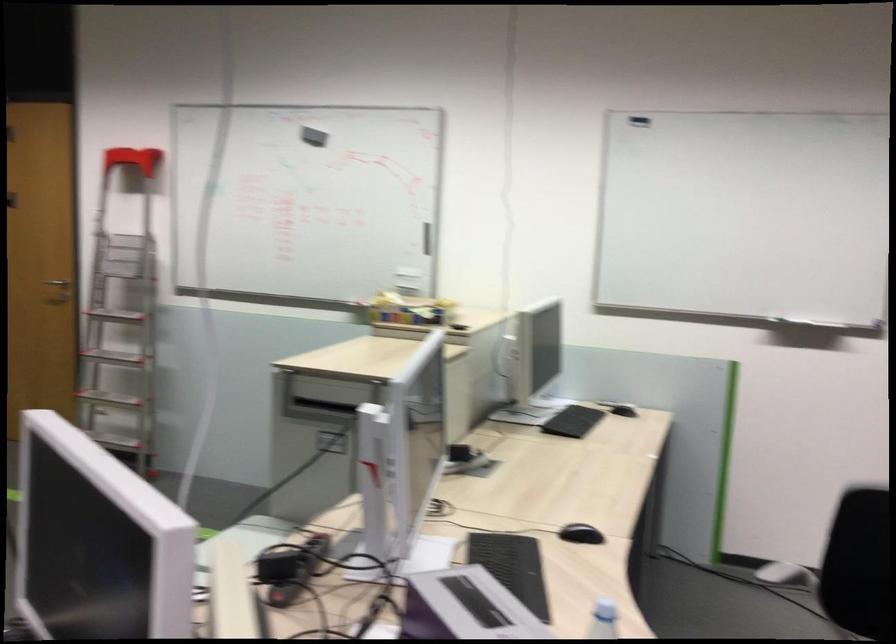
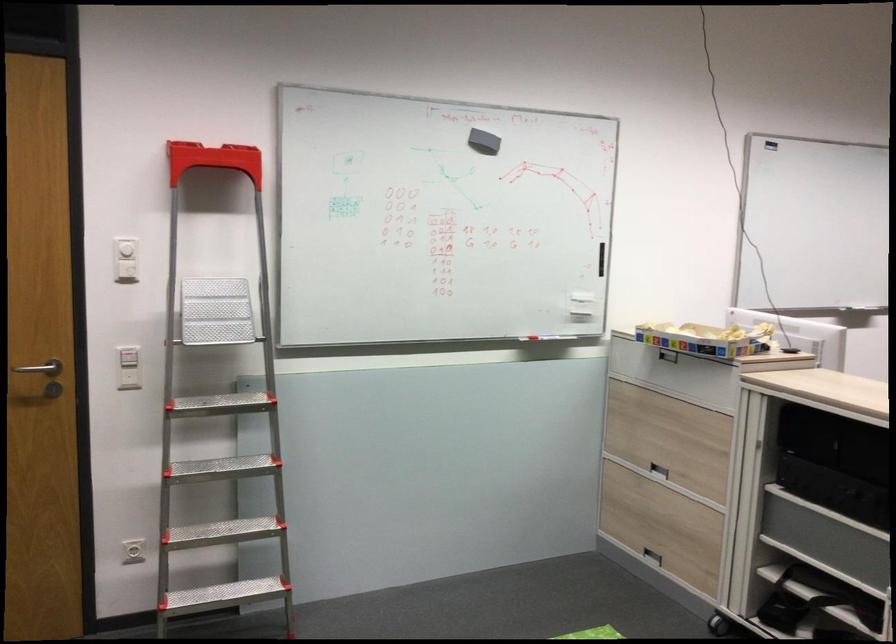
Where in the second image is the point corresponding to point (182, 149) from the first image?

(213, 160)